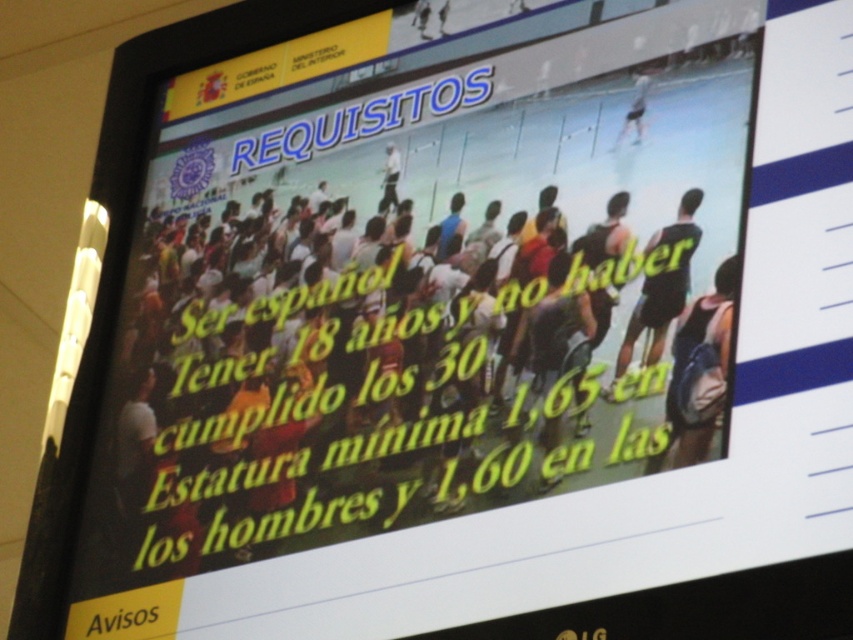
You are an athlete preparing for a competition and need to choose between the dark blue athletic shorts at center and the light blue fabric shorts at upper right. Based on their widths, which pair would be more comfortable for you if you prefer wider shorts?

The dark blue athletic shorts at center have a greater width than the light blue fabric shorts at upper right, so they would be more comfortable if you prefer wider shorts.

You are standing in front of the digital display screen showing the requirements. You notice a matte black backpack at center and a light blue fabric shorts at upper right. Which object is positioned lower on the screen?

The matte black backpack at center is positioned below the light blue fabric shorts at upper right, so it is lower on the screen.